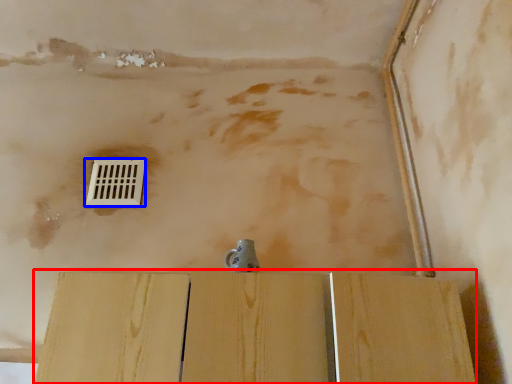
Question: Which object is further to the camera taking this photo, plywood (highlighted by a red box) or window (highlighted by a blue box)?

Choices:
 (A) plywood
 (B) window

Answer: (B)